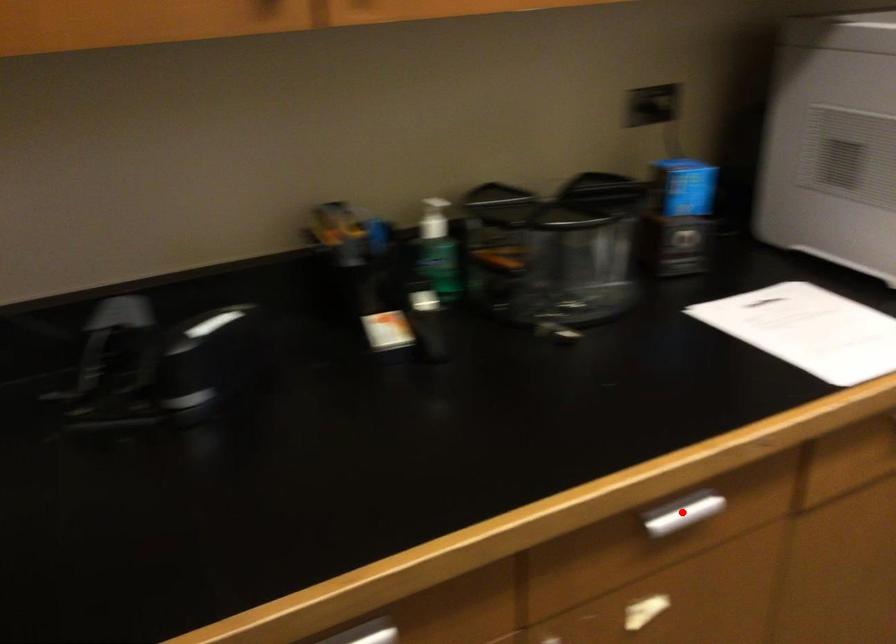
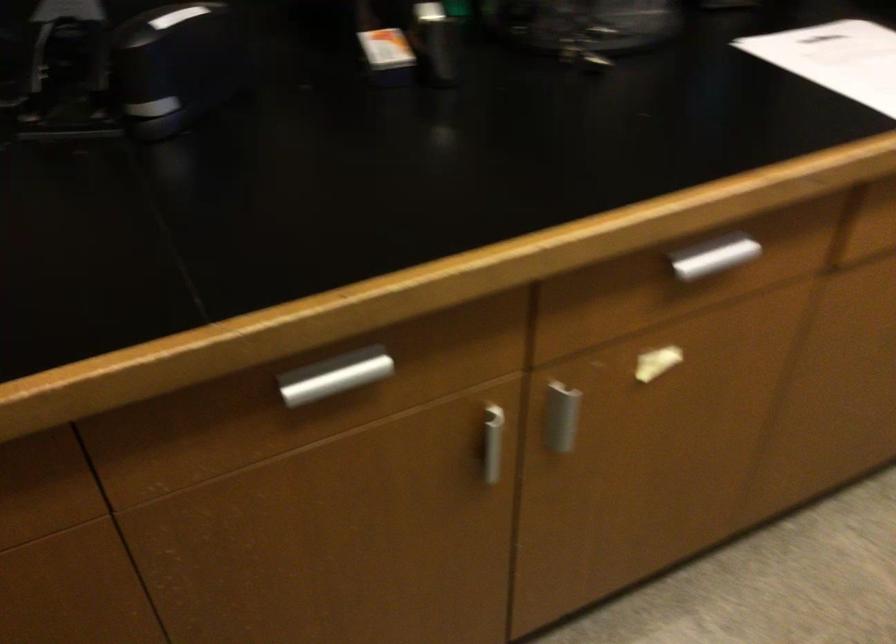
Locate, in the second image, the point that corresponds to the highlighted location in the first image.

(713, 257)